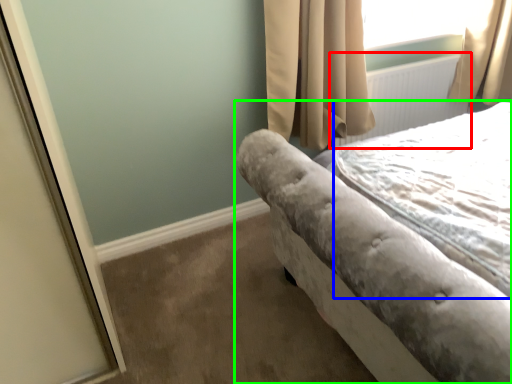
Question: Estimate the real-world distances between objects in this image. Which object is farther from radiator (highlighted by a red box), sheet (highlighted by a blue box) or bed (highlighted by a green box)?

Choices:
 (A) sheet
 (B) bed

Answer: (B)